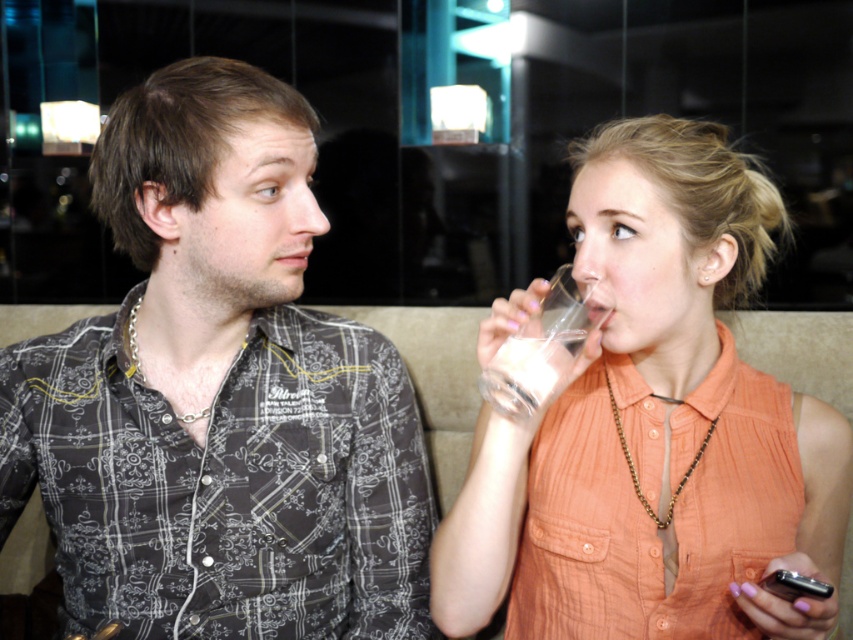
You are a photographer trying to capture a closeup of the clear glass at upper right without including the matte orange shirt at right in the frame. Given their sizes, is this possible?

The matte orange shirt at right is larger in size than clear glass at upper right, so it might be challenging to frame the clear glass at upper right without including the matte orange shirt at right due to its larger size taking up more space in the scene.

You are standing in front of a large mirror in the room. You notice a point marked at coordinates point (480,572). If the mirror is 3 feet away from you, can you reach the point without moving closer to the mirror?

The point (480,572) is 32.08 inches away from the camera. Since 3 feet equals 36 inches, the point is closer to you than the mirror. Therefore, you can reach it without moving closer.

You are a photographer setting up a shoot in this living room. You need to position a light source to the left of both the patterned fabric shirt at center and the matte orange shirt at right. Is this possible given their current positions?

The patterned fabric shirt at center is to the left of the matte orange shirt at right. Therefore, placing a light source to the left of both would require it to be positioned even further left than the patterned fabric shirt at center, which is already the leftmost of the two. This is feasible as long as there is space available to the left of the patterned fabric shirt at center in the scene.